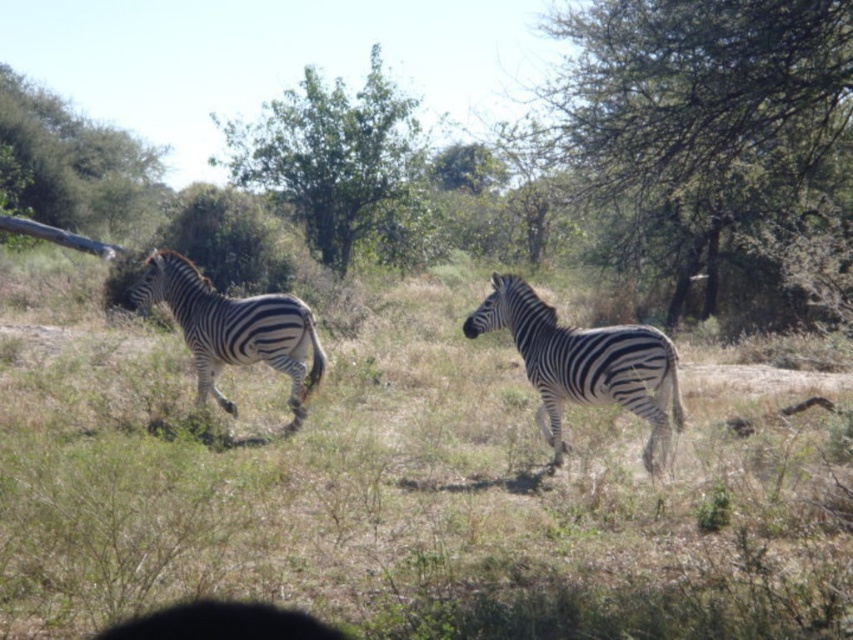
Question: Does green leafy tree at center appear on the left side of green leafy tree at upper left?

Choices:
 (A) no
 (B) yes

Answer: (A)

Question: Based on their relative distances, which object is farther from the green leafy tree at upper left?

Choices:
 (A) green leafy tree at center
 (B) black and white striped zebra at left

Answer: (B)

Question: Does green leafy tree at center come in front of black and white striped zebra at left?

Choices:
 (A) yes
 (B) no

Answer: (B)

Question: Which point appears farthest from the camera in this image?

Choices:
 (A) (67, 122)
 (B) (296, 420)

Answer: (A)

Question: Which object appears closest to the camera in this image?

Choices:
 (A) green leafy tree at upper left
 (B) green leafy tree at upper right
 (C) green leafy tree at center

Answer: (B)

Question: Does green leafy tree at center have a larger size compared to black and white striped zebra at left?

Choices:
 (A) no
 (B) yes

Answer: (B)